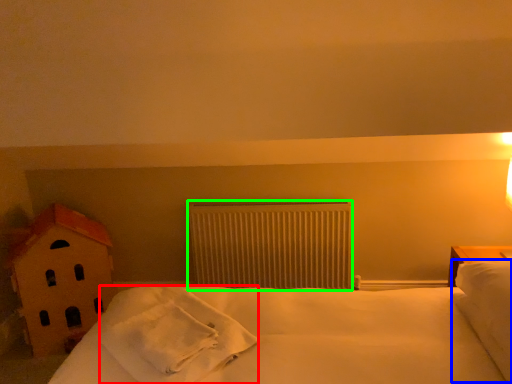
Question: Estimate the real-world distances between objects in this image. Which object is closer to material (highlighted by a red box), pillow (highlighted by a blue box) or radiator (highlighted by a green box)?

Choices:
 (A) pillow
 (B) radiator

Answer: (B)